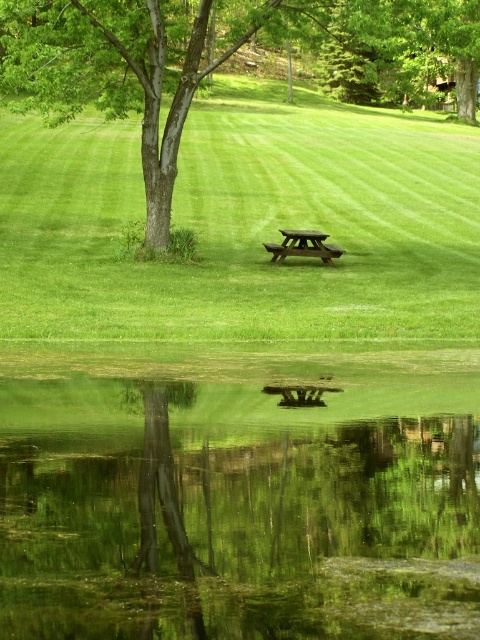
Question: Does green leafy tree at upper center have a smaller size compared to brown wooden bench at center?

Choices:
 (A) no
 (B) yes

Answer: (A)

Question: Does green leafy tree at center have a lesser width compared to brown wooden picnic table at center?

Choices:
 (A) yes
 (B) no

Answer: (B)

Question: Which is farther from the brown wooden bench at center?

Choices:
 (A) green leafy tree at upper center
 (B) brown wooden picnic table at center

Answer: (A)

Question: Estimate the real-world distances between objects in this image. Which object is farther from the green leafy tree at upper center?

Choices:
 (A) green leafy tree at center
 (B) brown wooden picnic table at center

Answer: (B)

Question: From the image, what is the correct spatial relationship of green leafy tree at upper center in relation to brown wooden picnic table at center?

Choices:
 (A) left
 (B) right

Answer: (B)

Question: Which point is farther to the camera?

Choices:
 (A) (169, 147)
 (B) (278, 259)
 (C) (303, 248)

Answer: (C)